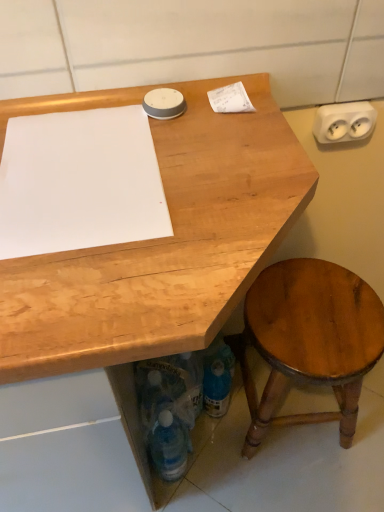
Question: Are white paper at upper right, the first notepad in the right-to-left sequence, and white plastic electrical outlet at upper right making contact?

Choices:
 (A) yes
 (B) no

Answer: (B)

Question: Can you confirm if white paper at upper right, positioned as the 2th notepad in left-to-right order, is wider than white plastic electrical outlet at upper right?

Choices:
 (A) yes
 (B) no

Answer: (A)

Question: Is white paper at upper right, placed as the first notepad when sorted from top to bottom, oriented away from white plastic electrical outlet at upper right?

Choices:
 (A) no
 (B) yes

Answer: (A)

Question: Is the position of white paper at upper right, acting as the second notepad starting from the bottom, less distant than that of white plastic electrical outlet at upper right?

Choices:
 (A) no
 (B) yes

Answer: (B)

Question: Does white paper at upper right, acting as the second notepad starting from the bottom, have a larger size compared to white plastic electrical outlet at upper right?

Choices:
 (A) no
 (B) yes

Answer: (A)

Question: In terms of width, does translucent plastic bottle at lower center, the 2th bottle positioned from the right, look wider or thinner when compared to white paper at upper left, acting as the second notepad starting from the top?

Choices:
 (A) wide
 (B) thin

Answer: (B)

Question: Is translucent plastic bottle at lower center, which is the 1th bottle from left to right, in front of or behind white paper at upper left, arranged as the first notepad when ordered from the bottom, in the image?

Choices:
 (A) behind
 (B) front

Answer: (A)

Question: Is translucent plastic bottle at lower center, the 2th bottle positioned from the right, spatially inside white paper at upper left, arranged as the first notepad when ordered from the bottom, or outside of it?

Choices:
 (A) inside
 (B) outside

Answer: (B)

Question: From a real-world perspective, is translucent plastic bottle at lower center, the 2th bottle positioned from the right, positioned above or below white paper at upper left, acting as the second notepad starting from the top?

Choices:
 (A) below
 (B) above

Answer: (A)

Question: From the image's perspective, is translucent plastic bottle at lower center, arranged as the first bottle when viewed from the right, above or below white paper at upper right, positioned as the 2th notepad in left-to-right order?

Choices:
 (A) below
 (B) above

Answer: (A)

Question: From a real-world perspective, relative to white paper at upper right, positioned as the 2th notepad in left-to-right order, is translucent plastic bottle at lower center, arranged as the first bottle when viewed from the right, vertically above or below?

Choices:
 (A) above
 (B) below

Answer: (B)

Question: In terms of height, does translucent plastic bottle at lower center, which ranks as the 2th bottle in left-to-right order, look taller or shorter compared to white paper at upper right, placed as the first notepad when sorted from top to bottom?

Choices:
 (A) short
 (B) tall

Answer: (B)

Question: Considering the positions of translucent plastic bottle at lower center, which ranks as the 2th bottle in left-to-right order, and white paper at upper right, positioned as the 2th notepad in left-to-right order, in the image, is translucent plastic bottle at lower center, which ranks as the 2th bottle in left-to-right order, bigger or smaller than white paper at upper right, positioned as the 2th notepad in left-to-right order,?

Choices:
 (A) big
 (B) small

Answer: (A)

Question: Is white paper at upper right, acting as the second notepad starting from the bottom, inside the boundaries of white paper at upper left, arranged as the first notepad when ordered from the bottom, or outside?

Choices:
 (A) outside
 (B) inside

Answer: (A)

Question: Looking at the image, does white paper at upper right, the first notepad in the right-to-left sequence, seem bigger or smaller compared to white paper at upper left, acting as the second notepad starting from the top?

Choices:
 (A) small
 (B) big

Answer: (A)